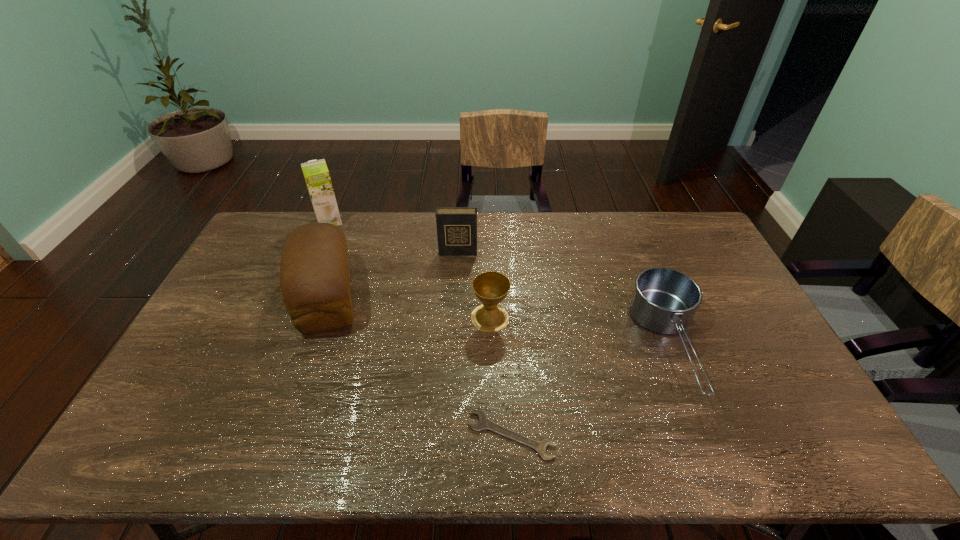
This screenshot has height=540, width=960. Identify the location of vacant space that's between the shortest object and the third shortest object. tap(500, 376).

Locate an element on the screen. The width and height of the screenshot is (960, 540). vacant point located between the chalice and the wrench is located at coordinates (500, 376).

Image resolution: width=960 pixels, height=540 pixels. In order to click on free spot between the bread and the chalice in this screenshot , I will do `click(408, 307)`.

Locate an element on the screen. The width and height of the screenshot is (960, 540). vacant region between the saucepan and the fourth tallest object is located at coordinates (581, 332).

Identify the location of unoccupied area between the third tallest object and the tallest object. This screenshot has width=960, height=540. (394, 237).

Identify which object is the third nearest to the shortest object. Please provide its 2D coordinates. Your answer should be formatted as a tuple, i.e. [(x, y)], where the tuple contains the x and y coordinates of a point satisfying the conditions above.

[(314, 272)]

Locate which object ranks third in proximity to the diary. Please provide its 2D coordinates. Your answer should be formatted as a tuple, i.e. [(x, y)], where the tuple contains the x and y coordinates of a point satisfying the conditions above.

[(316, 174)]

This screenshot has width=960, height=540. I want to click on free spot that satisfies the following two spatial constraints: 1. on the front side of the wrench; 2. on the right side of the soya milk, so click(239, 435).

Where is `free space that satisfies the following two spatial constraints: 1. on the front cover of the second farthest object; 2. on the right side of the third shortest object`? free space that satisfies the following two spatial constraints: 1. on the front cover of the second farthest object; 2. on the right side of the third shortest object is located at coordinates (454, 318).